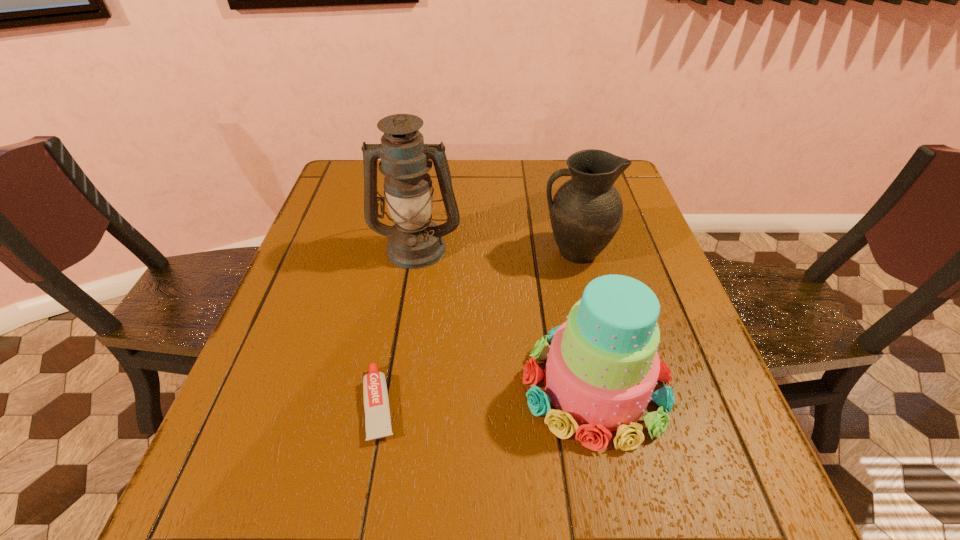
The height and width of the screenshot is (540, 960). Find the location of `free location that satisfies the following two spatial constraints: 1. on the side of the pitcher with the handle; 2. on the front side of the cake`. free location that satisfies the following two spatial constraints: 1. on the side of the pitcher with the handle; 2. on the front side of the cake is located at coordinates (607, 385).